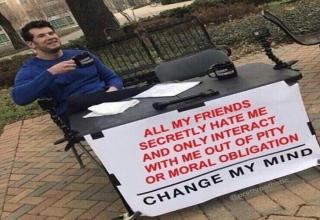
You are a GUI agent. You are given a task and a screenshot of the screen. Output one action in this format:
    pyautogui.click(x=<x>, y=<y>)
    Task: Click on the chair
    This screenshot has width=320, height=220.
    Given the screenshot: What is the action you would take?
    pyautogui.click(x=181, y=64), pyautogui.click(x=309, y=38), pyautogui.click(x=184, y=43), pyautogui.click(x=132, y=56)